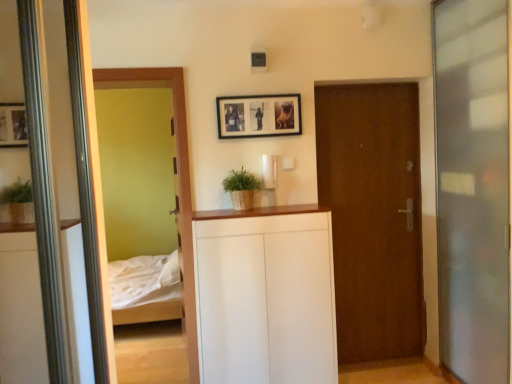
Question: From the image's perspective, relative to black matte picture frame at upper center, is brown wooden door at center above or below?

Choices:
 (A) below
 (B) above

Answer: (A)

Question: From a real-world perspective, is brown wooden door at center positioned above or below black matte picture frame at upper center?

Choices:
 (A) above
 (B) below

Answer: (B)

Question: Which is farther from the white matte cabinet at center?

Choices:
 (A) braided straw plant at center
 (B) transparent glass screen door at right
 (C) brown wooden door at center
 (D) black matte picture frame at upper center

Answer: (B)

Question: Which object is the farthest from the white matte cabinet at center?

Choices:
 (A) braided straw plant at center
 (B) transparent glass screen door at right
 (C) black matte picture frame at upper center
 (D) brown wooden door at center

Answer: (B)